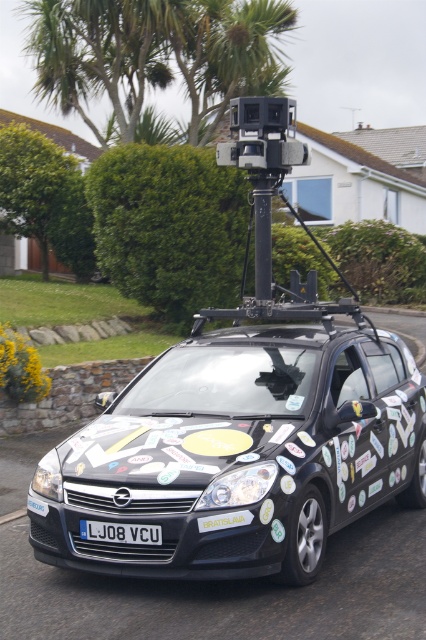
Does black plastic pole at center appear under black plastic license plate at center?

Actually, black plastic pole at center is above black plastic license plate at center.

Does black plastic pole at center appear over black plastic license plate at center?

Yes.

Which is behind, point (262, 182) or point (126, 529)?

The point (262, 182) is behind.

Identify the location of black plastic pole at center. (262, 232).

Does black glossy car at center appear on the left side of black plastic pole at center?

Indeed, black glossy car at center is positioned on the left side of black plastic pole at center.

Between point (193, 376) and point (270, 276), which one is positioned behind?

Positioned behind is point (270, 276).

Between point (255, 493) and point (270, 244), which one is positioned in front?

Positioned in front is point (255, 493).

The image size is (426, 640). I want to click on black glossy car at center, so click(238, 454).

Is black glossy car at center smaller than black plastic license plate at center?

No.

Which is above, black glossy car at center or black plastic license plate at center?

black glossy car at center is above.

Locate an element on the screen. black glossy car at center is located at coordinates (238, 454).

Identify the location of black glossy car at center. pos(238,454).